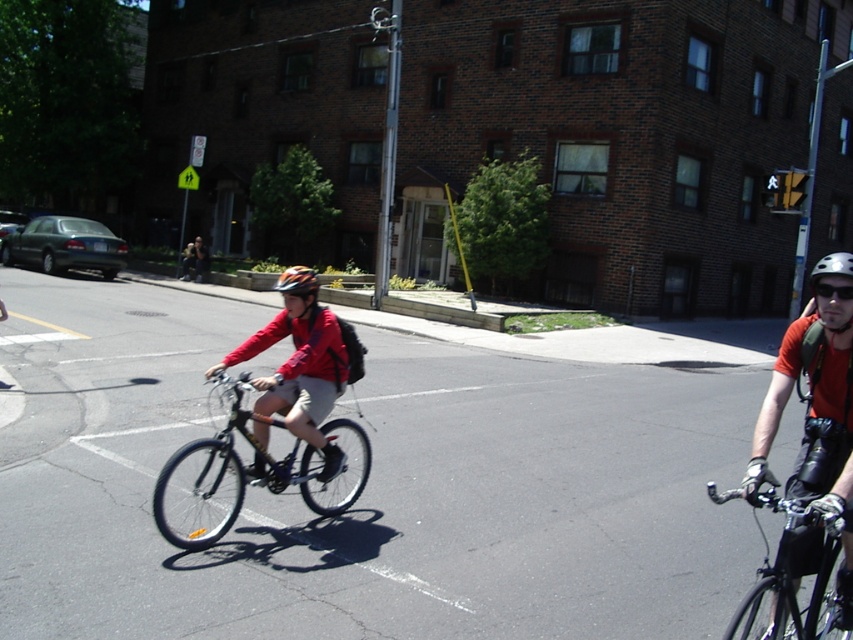
Question: Can you confirm if silver metallic bicycle at center is smaller than white matte bicycle helmet at upper right?

Choices:
 (A) yes
 (B) no

Answer: (A)

Question: Does orange matte helmet at center come behind white matte bicycle helmet at upper right?

Choices:
 (A) yes
 (B) no

Answer: (A)

Question: Which object is the farthest from the orange matte helmet at center?

Choices:
 (A) white matte bicycle helmet at upper right
 (B) shiny black bicycle at right

Answer: (A)

Question: Is silver metallic bicycle at center further to the viewer compared to orange matte helmet at center?

Choices:
 (A) yes
 (B) no

Answer: (B)

Question: Which of the following is the farthest from the observer?

Choices:
 (A) (357, 480)
 (B) (294, 273)

Answer: (A)

Question: Which object appears farthest from the camera in this image?

Choices:
 (A) matte red jacket at center
 (B) white matte bicycle helmet at upper right
 (C) orange matte helmet at center
 (D) silver metallic bicycle at center

Answer: (A)